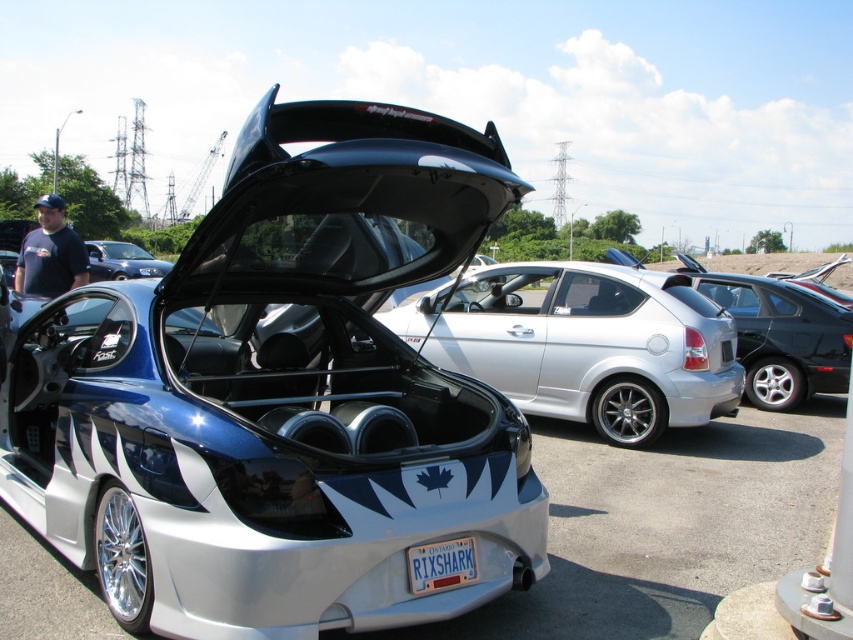
Question: Which point appears closest to the camera in this image?

Choices:
 (A) (68, 284)
 (B) (457, 573)

Answer: (B)

Question: Among these objects, which one is farthest from the camera?

Choices:
 (A) dark blue t-shirt at left
 (B) white plastic license plate at center
 (C) silver metallic hatchback at center
 (D) shiny metallic sedan at center

Answer: (D)

Question: Considering the real-world distances, which object is closest to the shiny metallic sedan at center?

Choices:
 (A) dark blue t-shirt at left
 (B) silver metallic hatchback at center
 (C) white plastic license plate at center

Answer: (B)

Question: Does dark blue t-shirt at left have a larger size compared to shiny metallic sedan at center?

Choices:
 (A) no
 (B) yes

Answer: (B)

Question: Is silver metallic hatchback at center below shiny metallic sedan at center?

Choices:
 (A) yes
 (B) no

Answer: (A)

Question: From the image, what is the correct spatial relationship of dark blue t-shirt at left in relation to white plastic license plate at center?

Choices:
 (A) left
 (B) right

Answer: (A)